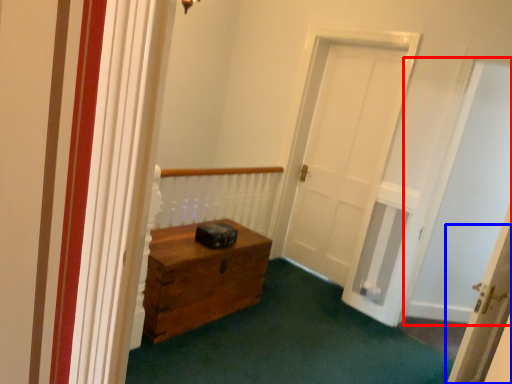
Question: Which point is closer to the camera, passage (highlighted by a red box) or door (highlighted by a blue box)?

Choices:
 (A) passage
 (B) door

Answer: (B)